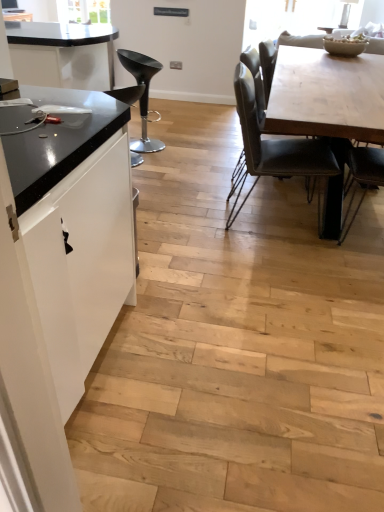
Question: From a real-world perspective, is black plastic stool at left, acting as the 2th chair starting from the right, beneath leatherette chair at center, the 3th chair viewed from the left?

Choices:
 (A) yes
 (B) no

Answer: (A)

Question: Is black plastic stool at left, acting as the 2th chair starting from the right, not close to leatherette chair at center, the 3th chair viewed from the left?

Choices:
 (A) yes
 (B) no

Answer: (A)

Question: Can you confirm if black plastic stool at left, the 2th chair viewed from the left, is taller than leatherette chair at center, the 3th chair viewed from the left?

Choices:
 (A) no
 (B) yes

Answer: (A)

Question: Considering the relative positions of black plastic stool at left, the 2th chair viewed from the left, and leatherette chair at center, the 1th chair when ordered from right to left, in the image provided, is black plastic stool at left, the 2th chair viewed from the left, in front of leatherette chair at center, the 1th chair when ordered from right to left,?

Choices:
 (A) yes
 (B) no

Answer: (B)

Question: Considering the relative sizes of black plastic stool at left, acting as the 2th chair starting from the right, and leatherette chair at center, the 1th chair when ordered from right to left, in the image provided, is black plastic stool at left, acting as the 2th chair starting from the right, shorter than leatherette chair at center, the 1th chair when ordered from right to left,?

Choices:
 (A) no
 (B) yes

Answer: (B)

Question: From a real-world perspective, is black plastic stool at left, the 2th chair viewed from the left, above or below white matte cabinet at left?

Choices:
 (A) below
 (B) above

Answer: (A)

Question: Is black plastic stool at left, acting as the 2th chair starting from the right, inside the boundaries of white matte cabinet at left, or outside?

Choices:
 (A) inside
 (B) outside

Answer: (B)

Question: Considering the positions of black plastic stool at left, acting as the 2th chair starting from the right, and white matte cabinet at left in the image, is black plastic stool at left, acting as the 2th chair starting from the right, bigger or smaller than white matte cabinet at left?

Choices:
 (A) small
 (B) big

Answer: (A)

Question: From the image's perspective, is black plastic stool at left, acting as the 2th chair starting from the right, located above or below white matte cabinet at left?

Choices:
 (A) above
 (B) below

Answer: (A)

Question: In the image, is light wood table at center on the left side or the right side of leatherette chair at center, the 3th chair viewed from the left?

Choices:
 (A) right
 (B) left

Answer: (A)

Question: Relative to leatherette chair at center, the 1th chair when ordered from right to left, is light wood table at center in front or behind?

Choices:
 (A) behind
 (B) front

Answer: (B)

Question: Is light wood table at center inside the boundaries of leatherette chair at center, the 3th chair viewed from the left, or outside?

Choices:
 (A) outside
 (B) inside

Answer: (A)

Question: From a real-world perspective, is light wood table at center physically located above or below leatherette chair at center, the 1th chair when ordered from right to left?

Choices:
 (A) below
 (B) above

Answer: (A)

Question: From the image's perspective, relative to white matte cabinet at left, is black leather bar stool at left, marked as the third chair in a right-to-left arrangement, above or below?

Choices:
 (A) above
 (B) below

Answer: (A)

Question: From a real-world perspective, relative to white matte cabinet at left, is black leather bar stool at left, placed as the 1th chair when sorted from left to right, vertically above or below?

Choices:
 (A) below
 (B) above

Answer: (A)